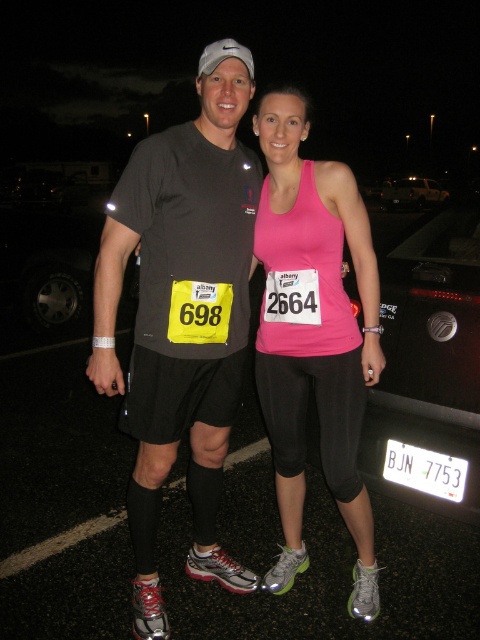
Question: Which point is farther to the camera?

Choices:
 (A) (372, 252)
 (B) (447, 476)

Answer: (B)

Question: Considering the relative positions of pink matte tank top at center and white plastic license plate at lower right in the image provided, where is pink matte tank top at center located with respect to white plastic license plate at lower right?

Choices:
 (A) above
 (B) below

Answer: (A)

Question: Which object appears farthest from the camera in this image?

Choices:
 (A) white plastic license plate at lower right
 (B) matte black t-shirt at center
 (C) pink matte tank top at center
 (D) black matte car at center

Answer: (D)

Question: Based on their relative distances, which object is farther from the white plastic license plate at lower right?

Choices:
 (A) matte black t-shirt at center
 (B) black matte car at center

Answer: (B)

Question: Is matte black t-shirt at center bigger than white plastic license plate at lower right?

Choices:
 (A) no
 (B) yes

Answer: (B)

Question: Does matte black t-shirt at center appear on the left side of white plastic license plate at lower right?

Choices:
 (A) no
 (B) yes

Answer: (B)